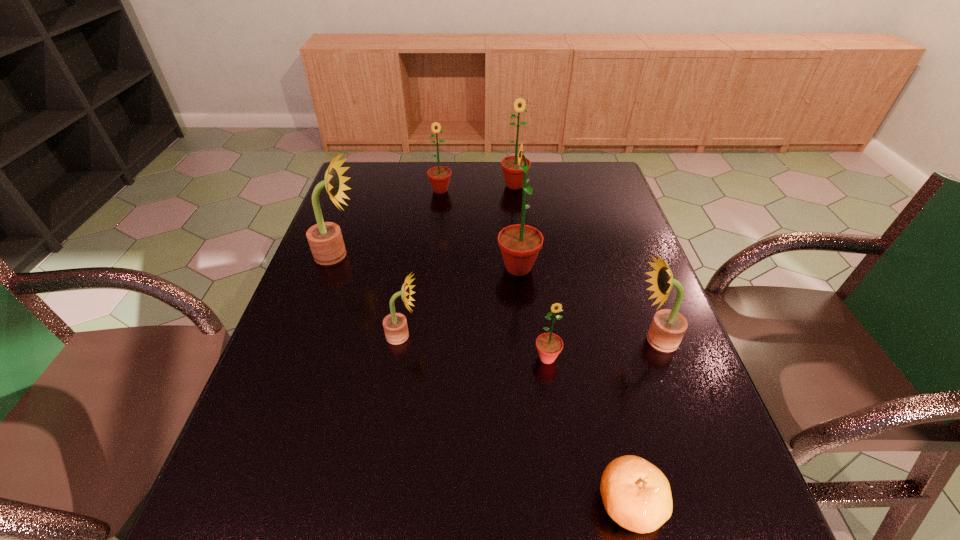
This screenshot has height=540, width=960. I want to click on the second nearest green sunflower, so click(520, 244).

I want to click on the tallest object, so pyautogui.click(x=520, y=244).

What are the coordinates of `the leftmost object` in the screenshot? It's located at (325, 239).

Locate an element on the screen. the biggest yellow sunflower is located at coordinates (325, 239).

Image resolution: width=960 pixels, height=540 pixels. I want to click on the third smallest green sunflower, so (514, 177).

Locate an element on the screen. The image size is (960, 540). the rightmost sunflower is located at coordinates (668, 327).

Image resolution: width=960 pixels, height=540 pixels. What are the coordinates of `the rightmost yellow sunflower` in the screenshot? It's located at (668, 327).

This screenshot has height=540, width=960. Identify the location of the leftmost green sunflower. (439, 176).

This screenshot has height=540, width=960. Identify the location of the second yellow sunflower from left to right. (395, 326).

The height and width of the screenshot is (540, 960). Identify the location of the smallest green sunflower. pos(549,345).